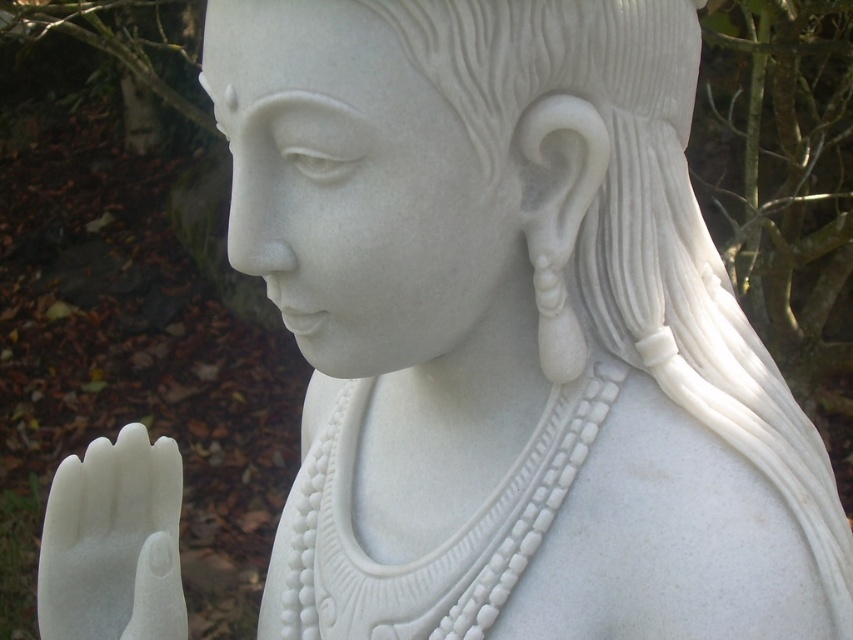
You are an art conservator who needs to clean the white marble statue at center. Your cleaning tool has a maximum reach of 25 inches. Can you safely clean the statue without moving the tool closer than 25 inches?

The distance of white marble statue at center from camera is 27.25 inches, which is farther than the tool can reach. Therefore, you cannot safely clean the statue without moving the tool closer than 25 inches.

Consider the image. You are an art conservator examining the white marble statue at center and the white marble hand at lower left. Which object would require a larger storage container for preservation?

The white marble statue at center is bigger than the white marble hand at lower left, so the statue would need a larger container for preservation.